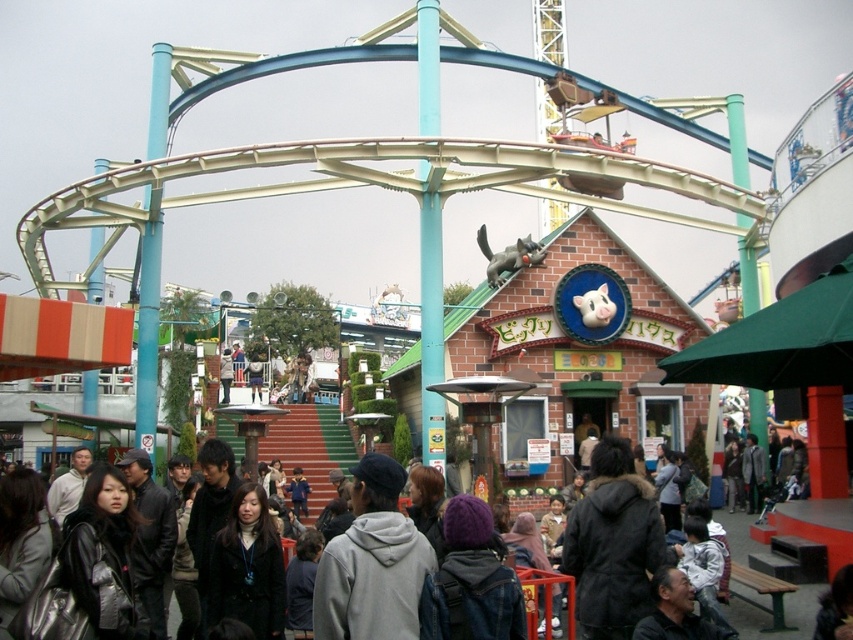
Where is the gray hoodie at center located in the image?

The gray hoodie at center is located at point (372, 563).

You are standing at the point marked by the coordinates point (372, 563) in the amusement park scene. What object is located at that exact position?

The point (372, 563) marks the location of the gray hoodie at center.